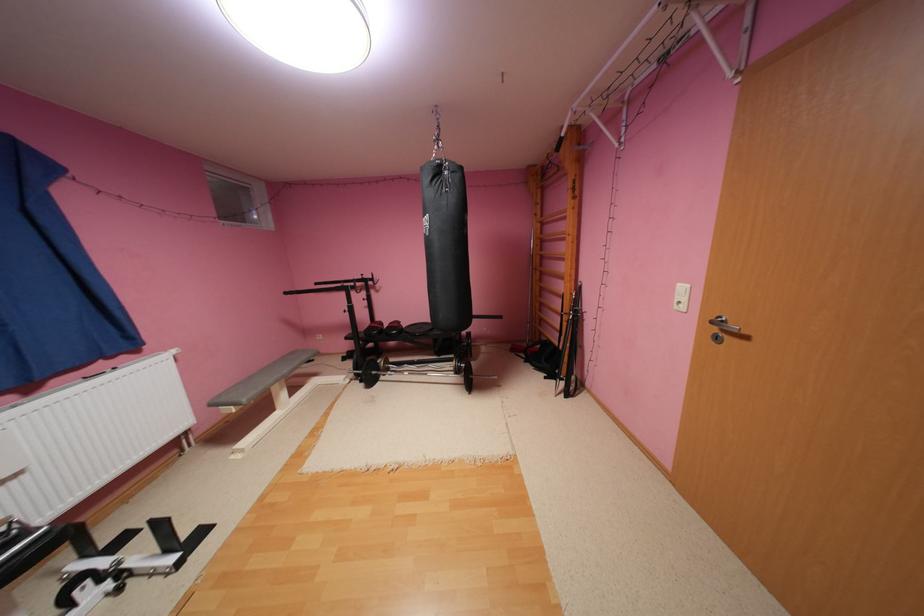
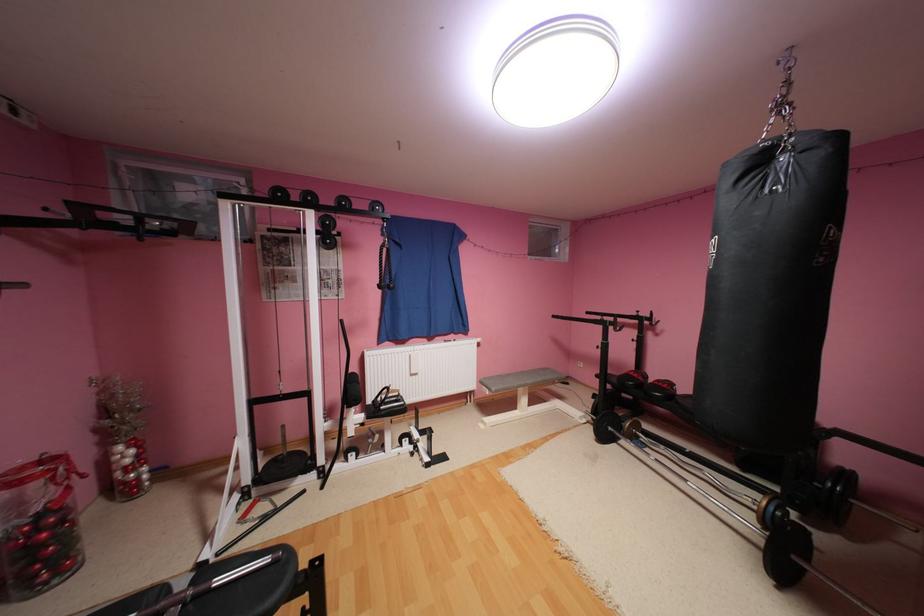
Find the pixel in the second image that matches pixel 295 371 in the first image.

(538, 382)